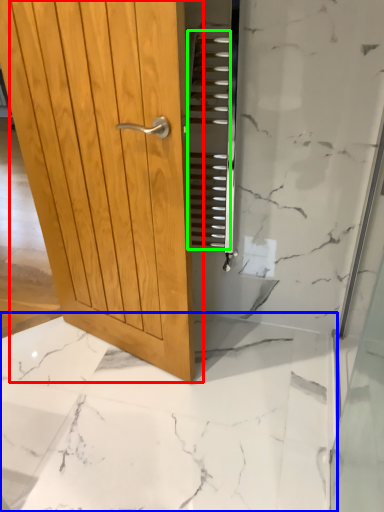
Question: Considering the real-world distances, which object is farthest from door (highlighted by a red box)? granite (highlighted by a blue box) or stair (highlighted by a green box)?

Choices:
 (A) granite
 (B) stair

Answer: (A)